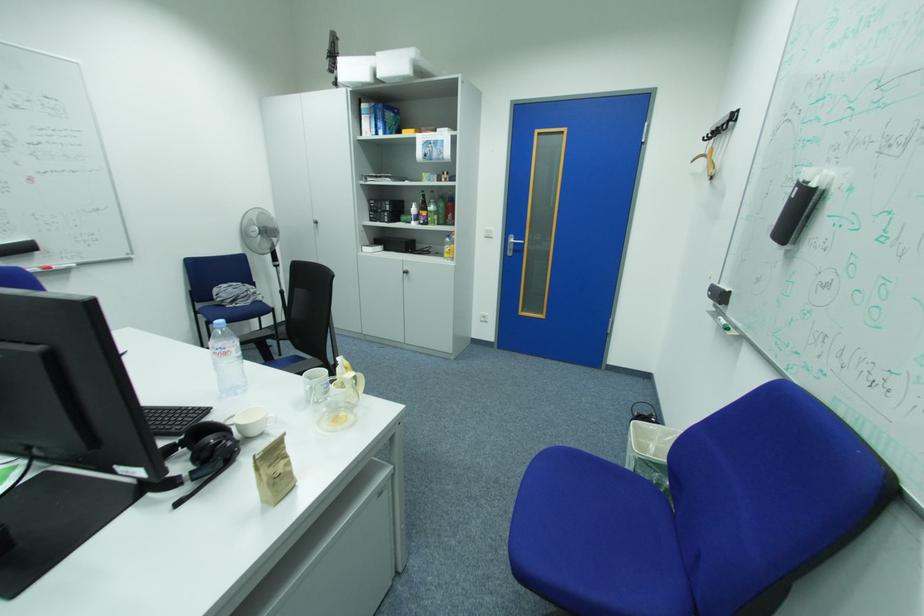
Find where to lift the glass pitcher handle. Please return your answer as a coordinate pair (x, y).

(357, 381)